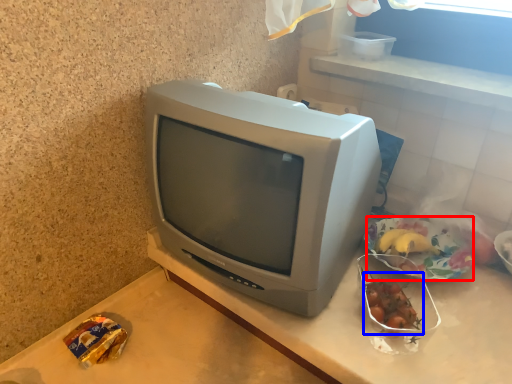
Question: Among these objects, which one is nearest to the camera, food (highlighted by a red box) or food (highlighted by a blue box)?

Choices:
 (A) food
 (B) food

Answer: (B)